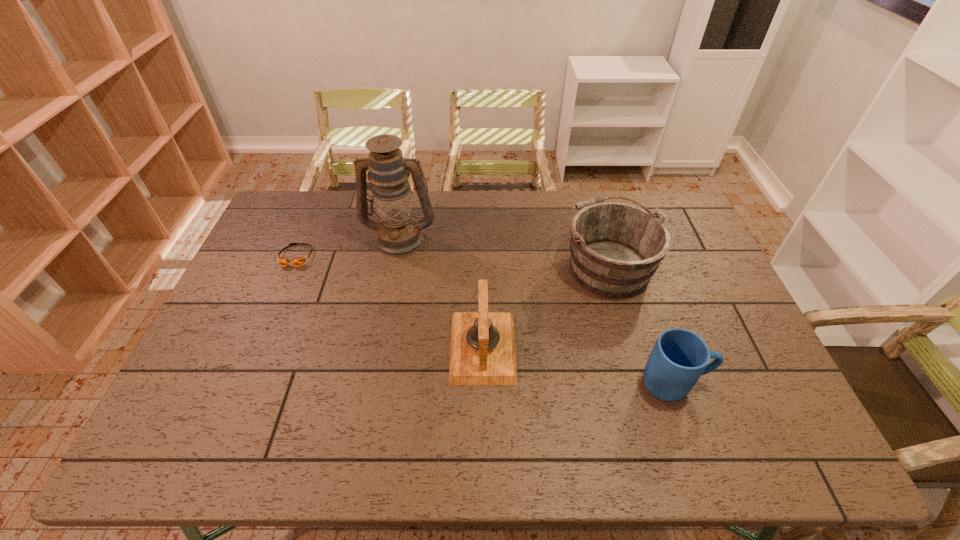
The height and width of the screenshot is (540, 960). Identify the location of vacant region between the third object from left to right and the wine bucket. (544, 307).

What are the coordinates of `free space between the wine bucket and the oil lamp` in the screenshot? It's located at [503, 252].

Find the location of a particular element. empty location between the bell and the wine bucket is located at coordinates (544, 307).

I want to click on unoccupied area between the third object from right to left and the fourth object from right to left, so click(x=442, y=293).

The width and height of the screenshot is (960, 540). Identify the location of vacant space that's between the mug and the oil lamp. (538, 311).

Locate an element on the screen. vacant area that lies between the mug and the wine bucket is located at coordinates (639, 325).

You are a GUI agent. You are given a task and a screenshot of the screen. Output one action in this format:
    pyautogui.click(x=<x>, y=<y>)
    Task: Click on the empty space between the wine bucket and the shortest object
    This screenshot has height=540, width=960.
    Given the screenshot: What is the action you would take?
    coord(451,261)

Identify the location of object that is the third closest to the wine bucket. Image resolution: width=960 pixels, height=540 pixels. (398, 234).

Identify which object is the fourth closest to the mug. Please provide its 2D coordinates. Your answer should be formatted as a tuple, i.e. [(x, y)], where the tuple contains the x and y coordinates of a point satisfying the conditions above.

[(284, 262)]

Where is `free point that satisfies the following two spatial constraints: 1. on the back side of the bell; 2. on the right side of the wine bucket`? This screenshot has width=960, height=540. free point that satisfies the following two spatial constraints: 1. on the back side of the bell; 2. on the right side of the wine bucket is located at coordinates (483, 266).